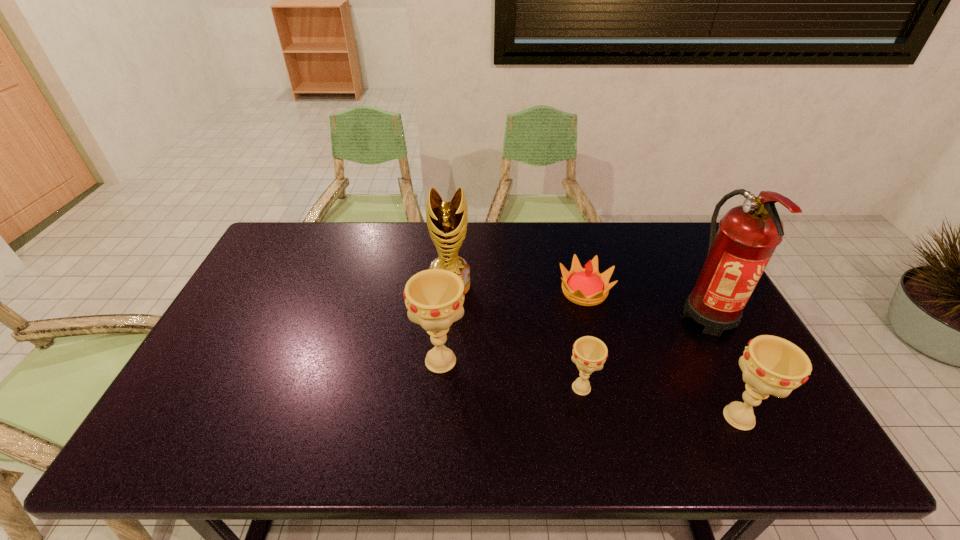
Locate an element on the screen. The height and width of the screenshot is (540, 960). the leftmost chalice is located at coordinates 434,298.

You are a GUI agent. You are given a task and a screenshot of the screen. Output one action in this format:
    pyautogui.click(x=<x>, y=<y>)
    Task: Click on the second shortest object
    
    Given the screenshot: What is the action you would take?
    pyautogui.click(x=589, y=353)

I want to click on the second chalice from right to left, so click(589, 353).

Where is `the second shortest chalice`? The height and width of the screenshot is (540, 960). the second shortest chalice is located at coordinates (771, 365).

The image size is (960, 540). I want to click on the fourth tallest object, so click(x=771, y=365).

Locate an element on the screen. crown is located at coordinates (586, 286).

In order to click on fire extinguisher in this screenshot , I will do `click(748, 234)`.

At what (x,y) coordinates should I click in order to perform the action: click on the fifth shortest object. Please return your answer as a coordinate pair (x, y). This screenshot has height=540, width=960. Looking at the image, I should click on (447, 221).

This screenshot has width=960, height=540. I want to click on blank space located on the back of the leftmost chalice, so click(x=449, y=261).

The image size is (960, 540). In order to click on vacant area situated 0.240m on the back of the second chalice from left to right in this screenshot , I will do `click(564, 308)`.